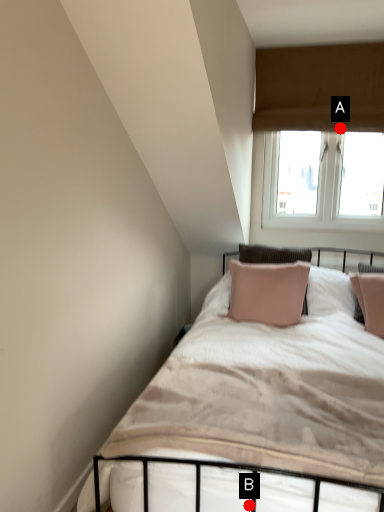
Question: Two points are circled on the image, labeled by A and B beside each circle. Which point appears farthest from the camera in this image?

Choices:
 (A) A is further
 (B) B is further

Answer: (A)